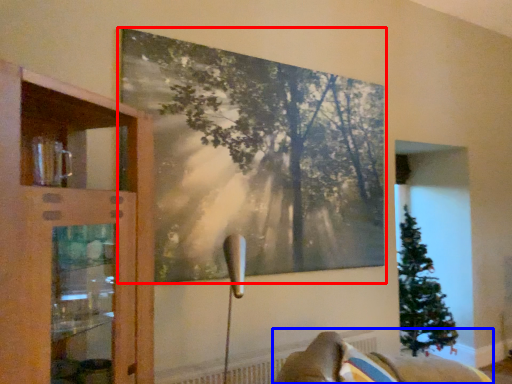
Question: Which point is further to the camera, picture frame (highlighted by a red box) or furniture (highlighted by a blue box)?

Choices:
 (A) picture frame
 (B) furniture

Answer: (A)